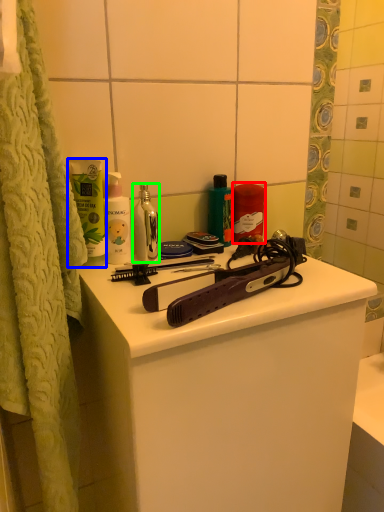
Question: Which object is the closest to the cleaning product (highlighted by a red box)? Choose among these: mouthwash (highlighted by a blue box) or mouthwash (highlighted by a green box).

Choices:
 (A) mouthwash
 (B) mouthwash

Answer: (B)